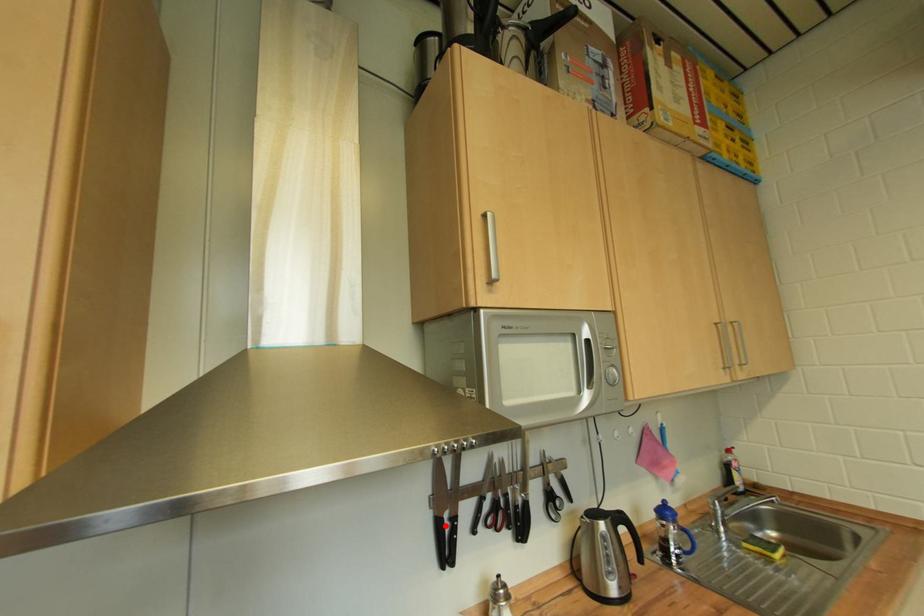
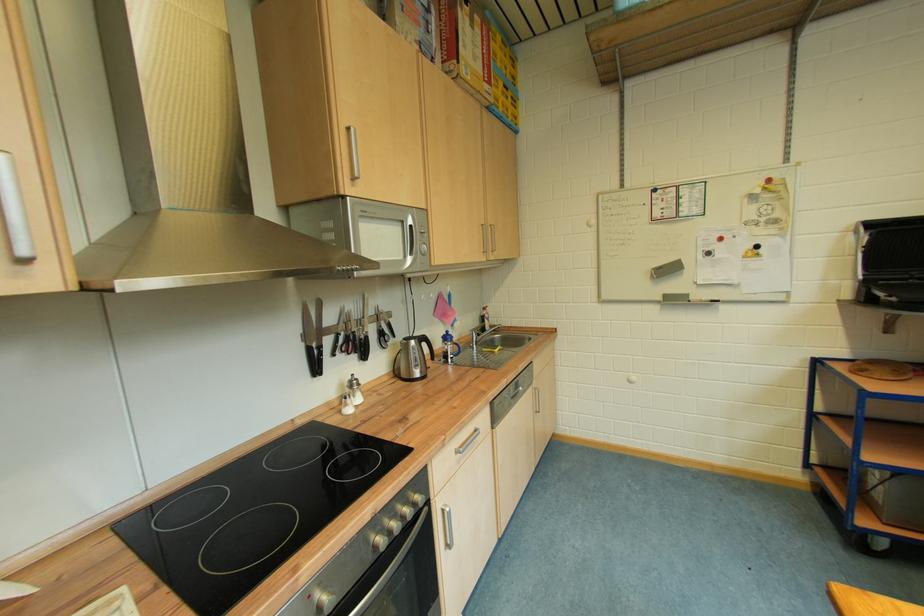
Question: I am providing you with two images of the same scene from different viewpoints. A red point is marked on the first image. At the location where the point appears in image 1, is it still visible in image 2?

Choices:
 (A) Yes
 (B) No

Answer: (A)